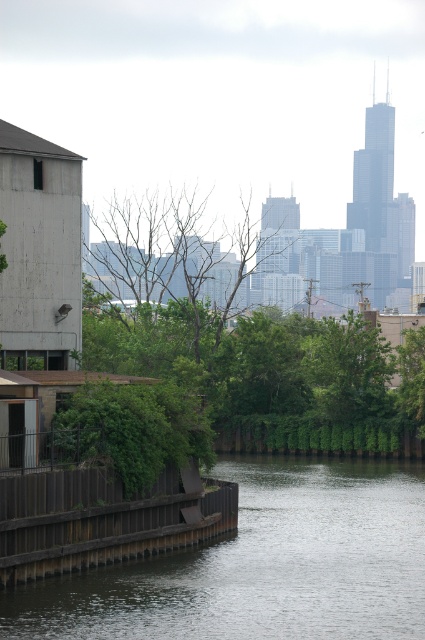
Question: Which object appears closest to the camera in this image?

Choices:
 (A) brown wooden dock at lower left
 (B) dark gray concrete river at lower center

Answer: (B)

Question: Considering the relative positions of dark gray concrete river at lower center and brown wooden dock at lower left in the image provided, where is dark gray concrete river at lower center located with respect to brown wooden dock at lower left?

Choices:
 (A) right
 (B) left

Answer: (A)

Question: Can you confirm if dark gray concrete river at lower center is positioned above brown wooden dock at lower left?

Choices:
 (A) yes
 (B) no

Answer: (B)

Question: Among these points, which one is farthest from the camera?

Choices:
 (A) (65, 563)
 (B) (238, 461)

Answer: (B)

Question: Can you confirm if dark gray concrete river at lower center is smaller than brown wooden dock at lower left?

Choices:
 (A) no
 (B) yes

Answer: (A)